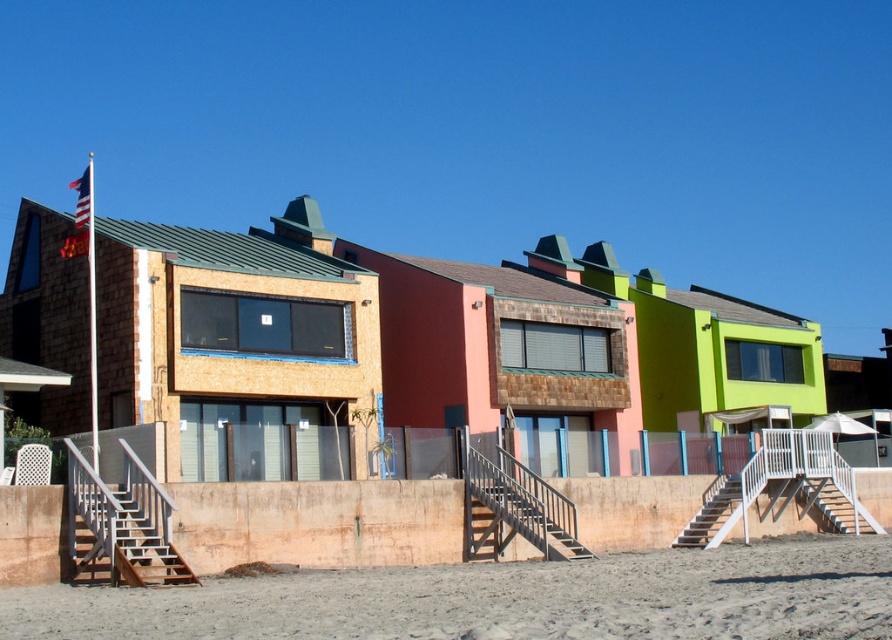
Consider the image. You are standing at the beach and want to place a picnic blanket between the brown wooden stairs at lower left and the american flag at upper left. The picnic blanket is 3 meters long. Will there be enough space between them to place the blanket?

The distance between the brown wooden stairs at lower left and the american flag at upper left is 8.53 meters, which is more than enough to place the 3 meter long picnic blanket between them.

You are a tourist standing on the beach looking towards the houses. You notice both the brown wooden stairs at lower left and the american flag at upper left. Which of these two objects appears smaller in the image?

The brown wooden stairs at lower left appears smaller compared to the american flag at upper left because the brown wooden stairs at lower left has a smaller size compared to american flag at upper left.